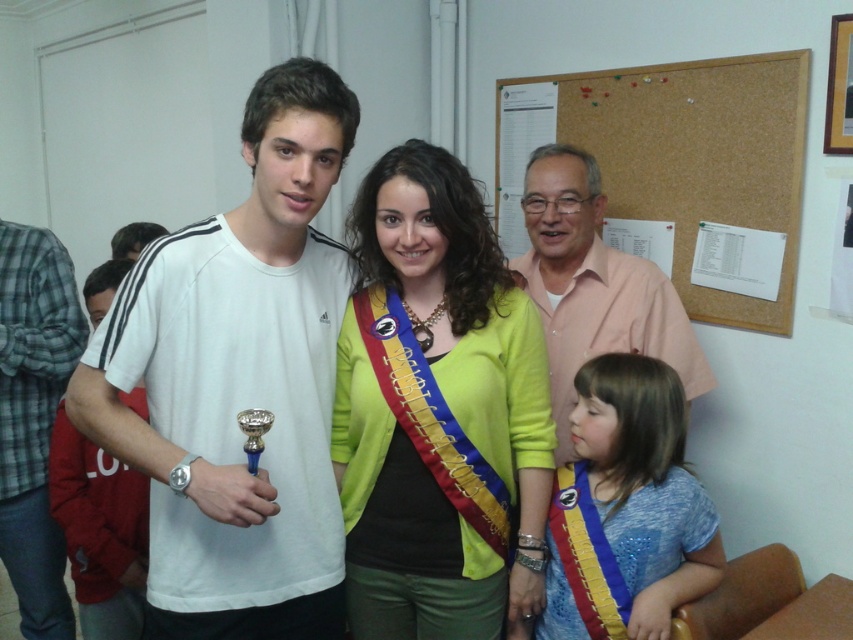
Does blue satin sash at lower right have a smaller size compared to pink cotton shirt at center?

Yes, blue satin sash at lower right is smaller than pink cotton shirt at center.

Does blue satin sash at lower right come behind pink cotton shirt at center?

No, blue satin sash at lower right is closer to the viewer.

Consider the image. Who is more distant from viewer, (x=650, y=388) or (x=541, y=180)?

Point (x=541, y=180)

Image resolution: width=853 pixels, height=640 pixels. I want to click on blue satin sash at lower right, so click(625, 508).

Which of these two, pink cotton shirt at center or white cotton shirt at left, stands taller?

pink cotton shirt at center is taller.

Between point (549, 252) and point (131, 516), which one is positioned behind?

The point (549, 252) is behind.

Where is `pink cotton shirt at center`? Image resolution: width=853 pixels, height=640 pixels. pink cotton shirt at center is located at coordinates (593, 284).

Who is shorter, green fabric sash at center or pink cotton shirt at center?

Standing shorter between the two is pink cotton shirt at center.

Is point (372, 612) farther from viewer compared to point (561, 305)?

No, (372, 612) is in front of (561, 305).

Identify the location of green fabric sash at center. The height and width of the screenshot is (640, 853). (437, 410).